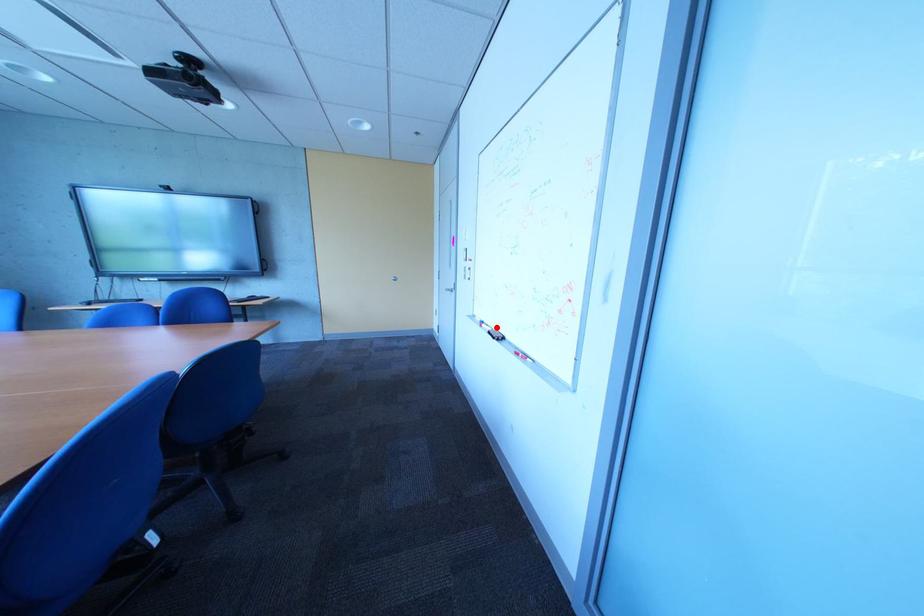
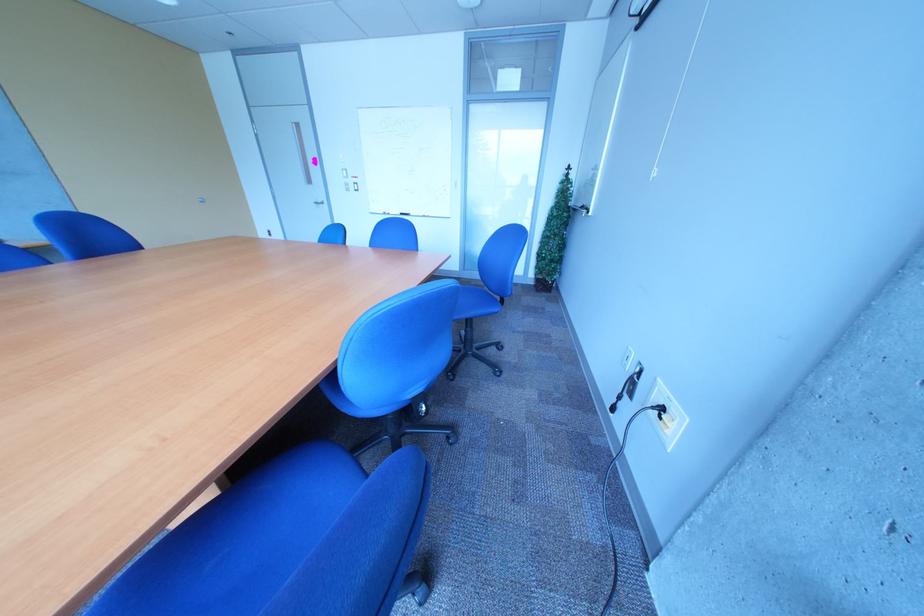
Where in the second image is the point corresponding to the highlighted location from the first image?

(405, 216)